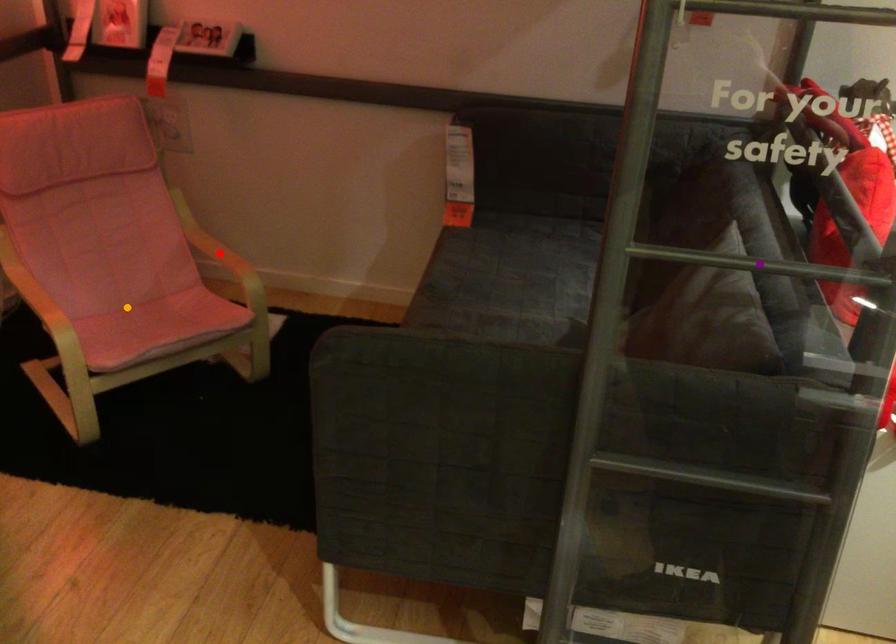
Looking at this image, order these from nearest to farthest:
purple point | red point | orange point

orange point → red point → purple point